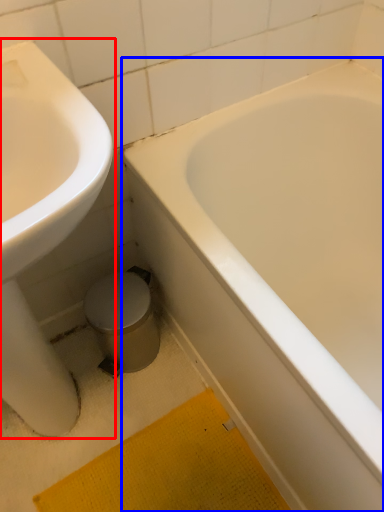
Question: Which of the following is the closest to the observer, sink (highlighted by a red box) or bathtub (highlighted by a blue box)?

Choices:
 (A) sink
 (B) bathtub

Answer: (A)